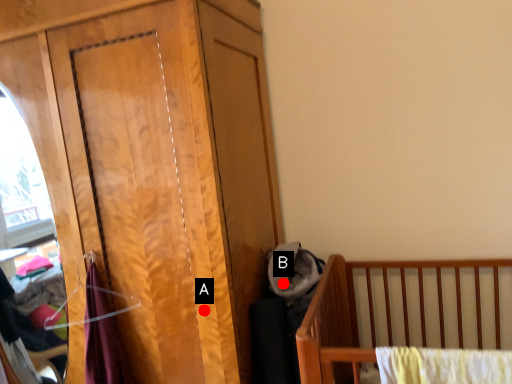
Question: Two points are circled on the image, labeled by A and B beside each circle. Among these points, which one is farthest from the camera?

Choices:
 (A) A is further
 (B) B is further

Answer: (B)